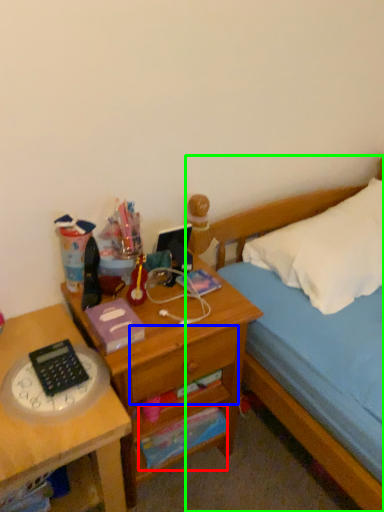
Question: Estimate the real-world distances between objects in this image. Which object is farther from paperback book (highlighted by a red box), drawer (highlighted by a blue box) or bed (highlighted by a green box)?

Choices:
 (A) drawer
 (B) bed

Answer: (B)